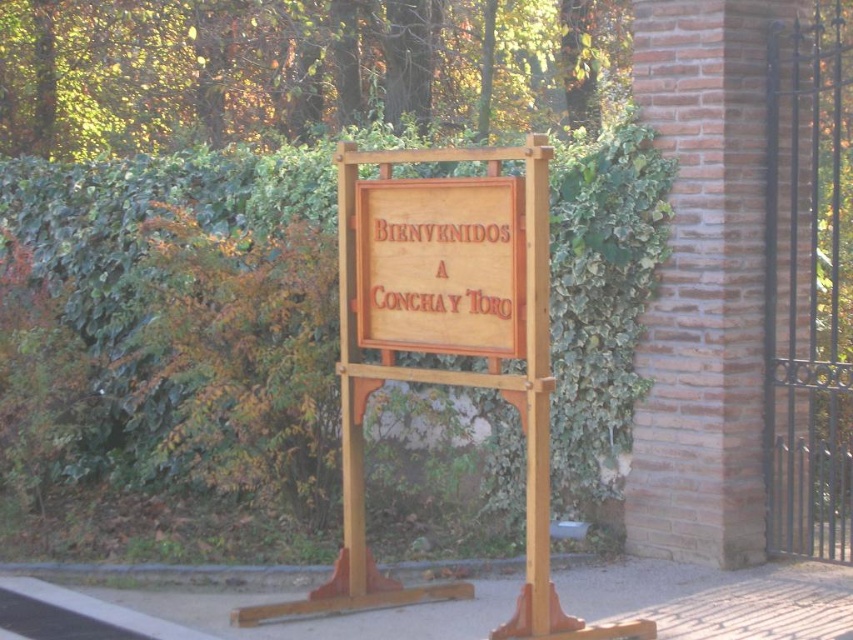
You are a visitor approaching the wooden sign at center and notice the green ivy hedge at center. Which object is located to the left of the other?

The green ivy hedge at center is positioned on the left side of wooden sign at center.

You are standing in front of the wooden signboard and want to place a small decoration between the two points, point (108, 376) and point (422, 276). Which point is closer to you so that you can place the decoration in front of it?

Point (108, 376) is closer to you, so you can place the decoration in front of it.

You are a gardener who needs to trim the green ivy hedge at center and the wooden sign at center. Which object is located lower in the scene?

The green ivy hedge at center is located below the wooden sign at center, so it is the lower object in the scene.